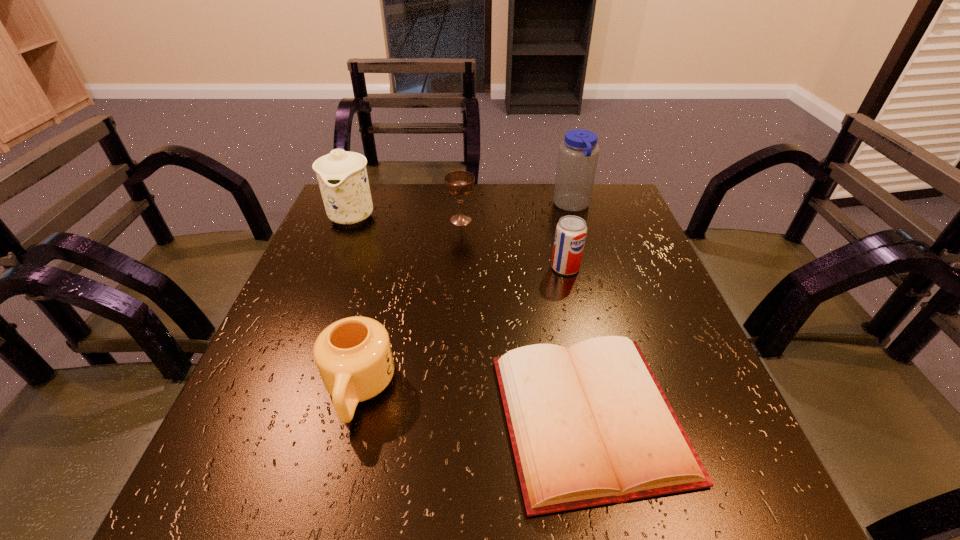
Locate an element on the screen. The height and width of the screenshot is (540, 960). free spot at the far right corner of the desktop is located at coordinates (605, 219).

At what (x,y) coordinates should I click in order to perform the action: click on empty location between the chinaware and the Bible. Please return your answer as a coordinate pair (x, y). Looking at the image, I should click on (471, 316).

You are a GUI agent. You are given a task and a screenshot of the screen. Output one action in this format:
    pyautogui.click(x=<x>, y=<y>)
    Task: Click on the unoccupied position between the third nearest object and the third object from left to right
    This screenshot has height=540, width=960.
    Given the screenshot: What is the action you would take?
    pyautogui.click(x=514, y=244)

Locate an element on the screen. free area in between the mug and the water bottle is located at coordinates (466, 298).

At what (x,y) coordinates should I click in order to perform the action: click on free space between the second object from left to right and the shortest object. Please return your answer as a coordinate pair (x, y). The image size is (960, 540). Looking at the image, I should click on (474, 403).

The height and width of the screenshot is (540, 960). Identify the location of free space between the third nearest object and the leftmost object. (459, 241).

Identify the location of free space between the mug and the shortest object. This screenshot has width=960, height=540. (474, 403).

Locate an element on the screen. This screenshot has width=960, height=540. free space that is in between the soda and the second object from left to right is located at coordinates (462, 329).

The height and width of the screenshot is (540, 960). I want to click on vacant area between the soda and the chalice, so click(x=514, y=244).

Identify the location of vacant space in between the Bible and the water bottle. (581, 312).